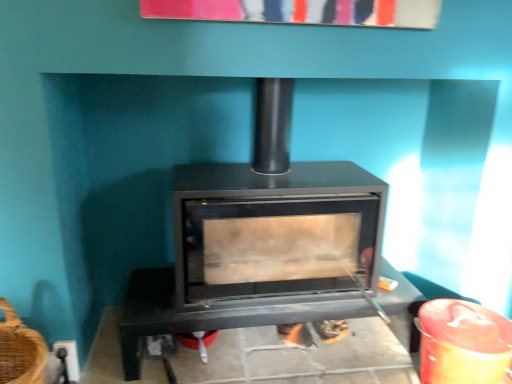
Question: From a real-world perspective, is black matte fireplace at center below black matte wood burning stove at center?

Choices:
 (A) yes
 (B) no

Answer: (A)

Question: Can we say black matte fireplace at center lies outside black matte wood burning stove at center?

Choices:
 (A) no
 (B) yes

Answer: (A)

Question: Is the position of black matte fireplace at center more distant than that of black matte wood burning stove at center?

Choices:
 (A) no
 (B) yes

Answer: (B)

Question: Is black matte fireplace at center looking in the opposite direction of black matte wood burning stove at center?

Choices:
 (A) yes
 (B) no

Answer: (A)

Question: Would you consider black matte fireplace at center to be distant from black matte wood burning stove at center?

Choices:
 (A) no
 (B) yes

Answer: (A)

Question: Is black matte fireplace at center at the right side of black matte wood burning stove at center?

Choices:
 (A) yes
 (B) no

Answer: (A)

Question: Is black matte wood burning stove at center at the right side of black matte fireplace at center?

Choices:
 (A) yes
 (B) no

Answer: (B)

Question: Is black matte wood burning stove at center not near black matte fireplace at center?

Choices:
 (A) no
 (B) yes

Answer: (A)

Question: Is black matte wood burning stove at center positioned behind black matte fireplace at center?

Choices:
 (A) yes
 (B) no

Answer: (B)

Question: Can you confirm if black matte wood burning stove at center is shorter than black matte fireplace at center?

Choices:
 (A) yes
 (B) no

Answer: (B)

Question: Considering the relative sizes of black matte wood burning stove at center and black matte fireplace at center in the image provided, is black matte wood burning stove at center thinner than black matte fireplace at center?

Choices:
 (A) yes
 (B) no

Answer: (A)

Question: Is black matte wood burning stove at center positioned with its back to black matte fireplace at center?

Choices:
 (A) yes
 (B) no

Answer: (B)

Question: Is black matte fireplace at center inside the boundaries of black matte wood burning stove at center, or outside?

Choices:
 (A) outside
 (B) inside

Answer: (B)